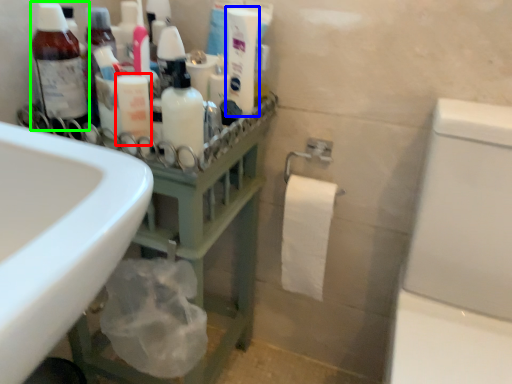
Question: Considering the real-world distances, which object is closest to toiletry (highlighted by a red box)? cleaning product (highlighted by a blue box) or bottle (highlighted by a green box).

Choices:
 (A) cleaning product
 (B) bottle

Answer: (B)